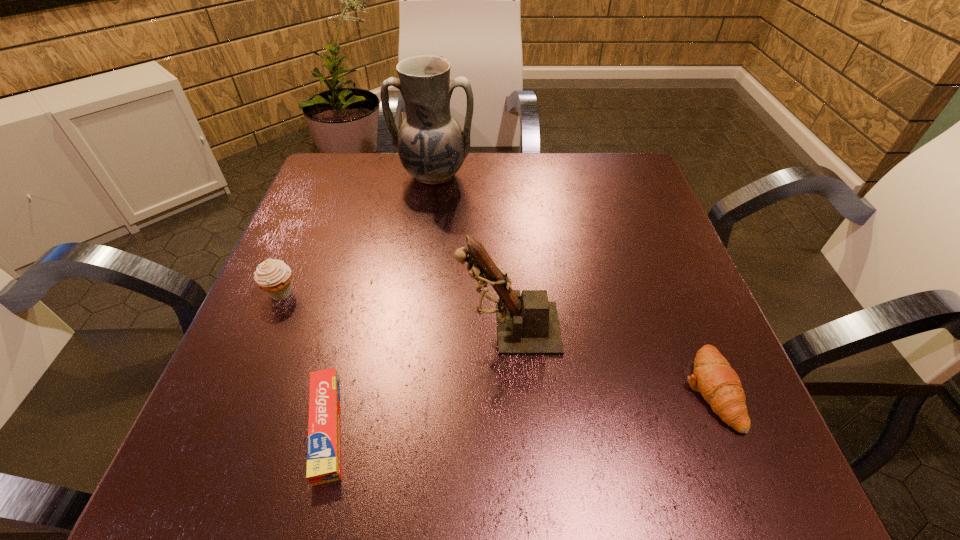
The width and height of the screenshot is (960, 540). In order to click on vacant space that satisfies the following two spatial constraints: 1. on the front-facing side of the crescent roll; 2. on the right side of the farthest object in this screenshot , I will do [x=405, y=389].

Where is `free region that satisfies the following two spatial constraints: 1. on the front-facing side of the second tallest object; 2. on the back side of the fourth tallest object`? free region that satisfies the following two spatial constraints: 1. on the front-facing side of the second tallest object; 2. on the back side of the fourth tallest object is located at coordinates (512, 389).

Find the location of a particular element. Image resolution: width=960 pixels, height=540 pixels. blank space that satisfies the following two spatial constraints: 1. on the front side of the crescent roll; 2. on the right side of the leftmost object is located at coordinates (241, 389).